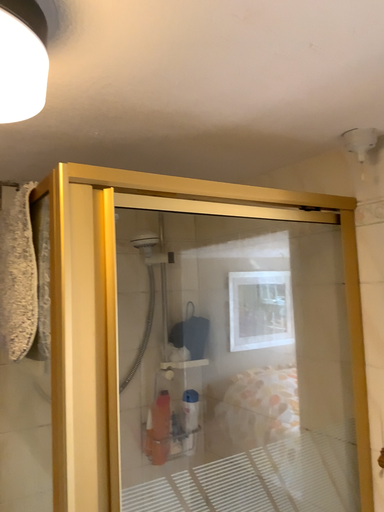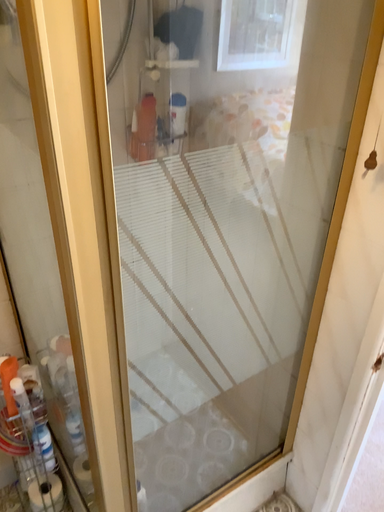
Question: How did the camera likely rotate when shooting the video?

Choices:
 (A) rotated downward
 (B) rotated upward

Answer: (A)